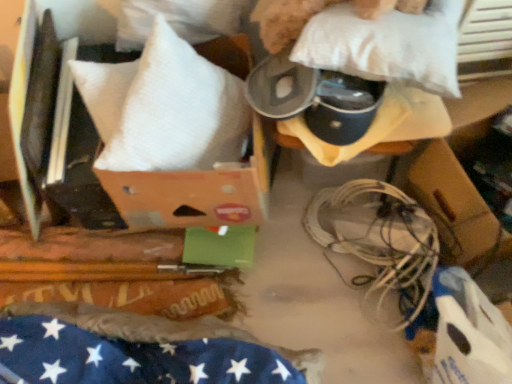
Question: From the image's perspective, is white matte wires at lower right on top of white soft pillow at upper left, the 2th pillow in the right-to-left sequence?

Choices:
 (A) no
 (B) yes

Answer: (A)

Question: Is white matte wires at lower right positioned behind white soft pillow at upper left, the 2th pillow in the right-to-left sequence?

Choices:
 (A) yes
 (B) no

Answer: (A)

Question: Can you confirm if white matte wires at lower right is bigger than white soft pillow at upper left, the 2th pillow in the right-to-left sequence?

Choices:
 (A) yes
 (B) no

Answer: (B)

Question: Does white matte wires at lower right have a lesser width compared to white soft pillow at upper left, the 2th pillow in the right-to-left sequence?

Choices:
 (A) yes
 (B) no

Answer: (A)

Question: From a real-world perspective, does white matte wires at lower right sit lower than white soft pillow at upper left, the first pillow positioned from the left?

Choices:
 (A) yes
 (B) no

Answer: (A)

Question: Is white matte wires at lower right at the left side of white soft pillow at upper left, the 2th pillow in the right-to-left sequence?

Choices:
 (A) no
 (B) yes

Answer: (A)

Question: Are white soft pillow at upper center, arranged as the first pillow when viewed from the right, and white matte wires at lower right located far from each other?

Choices:
 (A) no
 (B) yes

Answer: (A)

Question: Can you confirm if white soft pillow at upper center, which is the 2th pillow from left to right, is shorter than white matte wires at lower right?

Choices:
 (A) no
 (B) yes

Answer: (B)

Question: Does white soft pillow at upper center, which is the 2th pillow from left to right, have a greater width compared to white matte wires at lower right?

Choices:
 (A) yes
 (B) no

Answer: (B)

Question: Does white soft pillow at upper center, arranged as the first pillow when viewed from the right, turn towards white matte wires at lower right?

Choices:
 (A) yes
 (B) no

Answer: (B)

Question: Considering the relative sizes of white soft pillow at upper center, arranged as the first pillow when viewed from the right, and white matte wires at lower right in the image provided, is white soft pillow at upper center, arranged as the first pillow when viewed from the right, bigger than white matte wires at lower right?

Choices:
 (A) yes
 (B) no

Answer: (B)

Question: Are white soft pillow at upper center, which is the 2th pillow from left to right, and white matte wires at lower right making contact?

Choices:
 (A) yes
 (B) no

Answer: (B)

Question: Is white soft pillow at upper left, the 2th pillow in the right-to-left sequence, facing towards white matte wires at lower right?

Choices:
 (A) yes
 (B) no

Answer: (B)